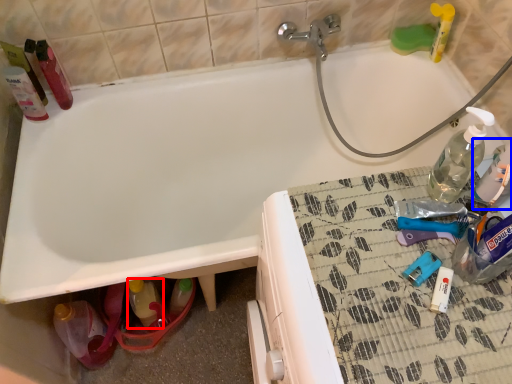
Question: Which object appears farthest to the camera in this image, bottle (highlighted by a red box) or bottle (highlighted by a blue box)?

Choices:
 (A) bottle
 (B) bottle

Answer: (A)